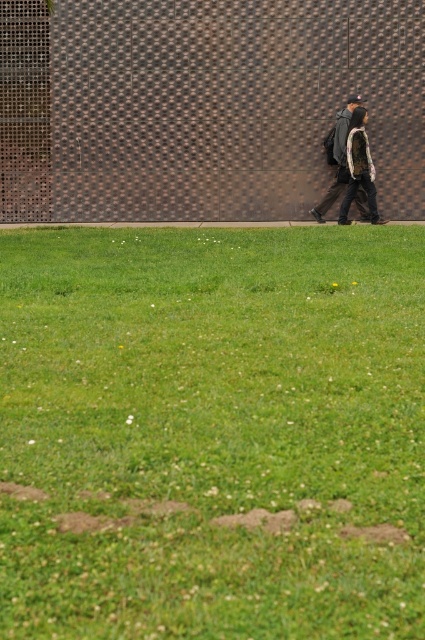
Does camouflage jacket at right lie behind dark gray backpack at center?

No, it is not.

Who is higher up, camouflage jacket at right or dark gray backpack at center?

dark gray backpack at center

Which is in front, point (362, 145) or point (336, 124)?

Positioned in front is point (362, 145).

Identify the location of camouflage jacket at right. (359, 168).

Is green grass at lower center to the left of dark gray backpack at center from the viewer's perspective?

Correct, you'll find green grass at lower center to the left of dark gray backpack at center.

Is green grass at lower center bigger than dark gray backpack at center?

Correct, green grass at lower center is larger in size than dark gray backpack at center.

Which is in front, point (305, 500) or point (329, 136)?

Point (305, 500)

Find the location of `green grass at lower center`. green grass at lower center is located at coordinates (212, 433).

Who is shorter, green grass at lower center or camouflage jacket at right?

Standing shorter between the two is green grass at lower center.

Is green grass at lower center closer to the viewer compared to camouflage jacket at right?

Yes, green grass at lower center is in front of camouflage jacket at right.

Between point (377, 598) and point (362, 170), which one is positioned behind?

The point (362, 170) is more distant.

You are a GUI agent. You are given a task and a screenshot of the screen. Output one action in this format:
    pyautogui.click(x=<x>, y=<y>)
    Task: Click on the green grass at lower center
    The image size is (425, 640).
    Given the screenshot: What is the action you would take?
    pyautogui.click(x=212, y=433)